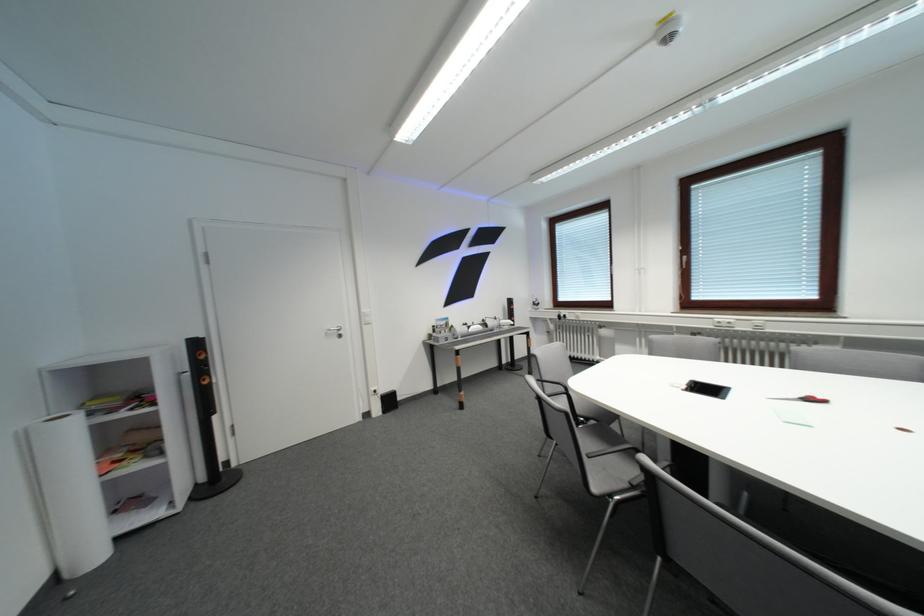
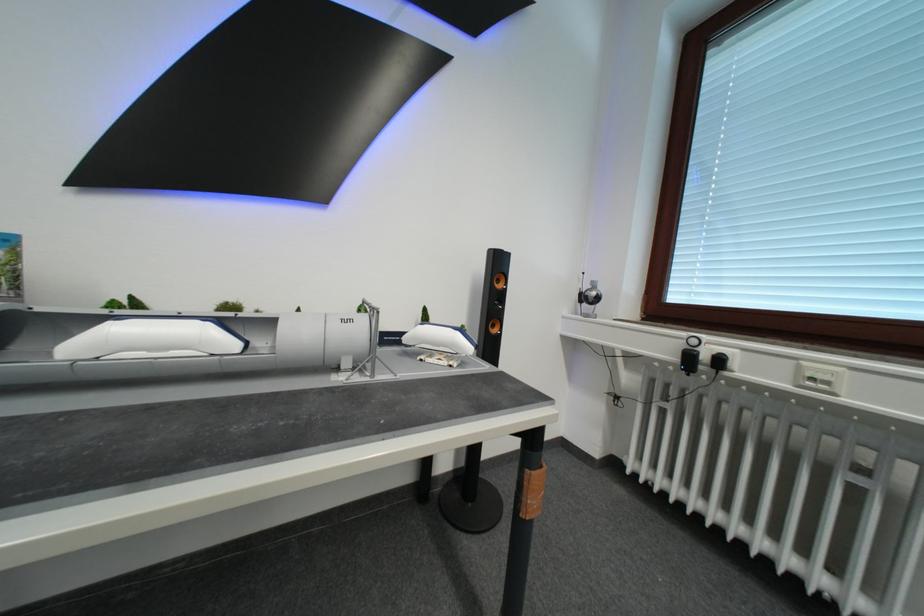
Question: What movement of the cameraman would produce the second image?

Choices:
 (A) Left
 (B) Right
 (C) Forward
 (D) Backward

Answer: (C)